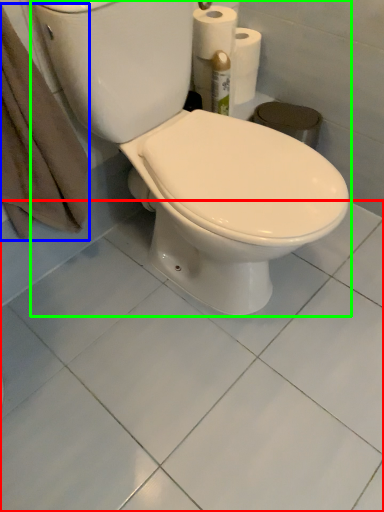
Question: Considering the real-world distances, which object is closest to ceramic tile (highlighted by a red box)? bath towel (highlighted by a blue box) or toilet (highlighted by a green box).

Choices:
 (A) bath towel
 (B) toilet

Answer: (B)